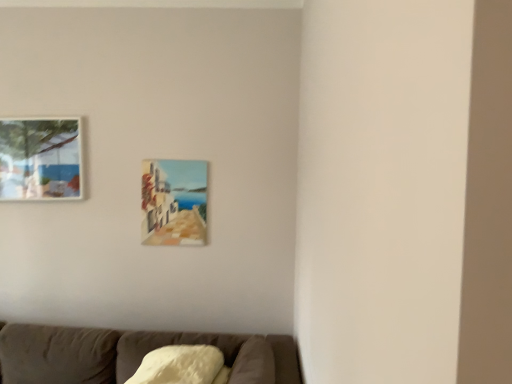
Question: Should I look upward or downward to see matte wooden picture frame at center, positioned as the second picture frame in left-to-right order?

Choices:
 (A) down
 (B) up

Answer: (A)

Question: From a real-world perspective, is matte wooden picture frame at center, the first picture frame when ordered from right to left, under matte glass picture frame at upper left, which appears as the 2th picture frame when viewed from the right?

Choices:
 (A) no
 (B) yes

Answer: (B)

Question: Is matte glass picture frame at upper left, the first picture frame positioned from the left, at the back of matte wooden picture frame at center, the first picture frame when ordered from right to left?

Choices:
 (A) no
 (B) yes

Answer: (A)

Question: From the image's perspective, is matte wooden picture frame at center, the first picture frame when ordered from right to left, located beneath matte glass picture frame at upper left, which appears as the 2th picture frame when viewed from the right?

Choices:
 (A) yes
 (B) no

Answer: (A)

Question: Does matte wooden picture frame at center, the first picture frame when ordered from right to left, have a lesser height compared to matte glass picture frame at upper left, which appears as the 2th picture frame when viewed from the right?

Choices:
 (A) yes
 (B) no

Answer: (B)

Question: Could you tell me if matte wooden picture frame at center, positioned as the second picture frame in left-to-right order, is facing matte glass picture frame at upper left, which appears as the 2th picture frame when viewed from the right?

Choices:
 (A) no
 (B) yes

Answer: (A)

Question: Can you confirm if matte wooden picture frame at center, the first picture frame when ordered from right to left, is smaller than matte glass picture frame at upper left, the first picture frame positioned from the left?

Choices:
 (A) no
 (B) yes

Answer: (B)

Question: Is matte glass picture frame at upper left, the first picture frame positioned from the left, turned away from matte wooden picture frame at center, positioned as the second picture frame in left-to-right order?

Choices:
 (A) yes
 (B) no

Answer: (B)

Question: Is matte glass picture frame at upper left, the first picture frame positioned from the left, taller than matte wooden picture frame at center, positioned as the second picture frame in left-to-right order?

Choices:
 (A) yes
 (B) no

Answer: (B)

Question: From a real-world perspective, is matte glass picture frame at upper left, which appears as the 2th picture frame when viewed from the right, over matte wooden picture frame at center, the first picture frame when ordered from right to left?

Choices:
 (A) no
 (B) yes

Answer: (B)

Question: Is matte glass picture frame at upper left, which appears as the 2th picture frame when viewed from the right, thinner than matte wooden picture frame at center, positioned as the second picture frame in left-to-right order?

Choices:
 (A) yes
 (B) no

Answer: (B)

Question: From a real-world perspective, does matte glass picture frame at upper left, which appears as the 2th picture frame when viewed from the right, sit lower than matte wooden picture frame at center, the first picture frame when ordered from right to left?

Choices:
 (A) yes
 (B) no

Answer: (B)

Question: Is matte glass picture frame at upper left, which appears as the 2th picture frame when viewed from the right, not inside matte wooden picture frame at center, the first picture frame when ordered from right to left?

Choices:
 (A) no
 (B) yes

Answer: (B)

Question: Is matte glass picture frame at upper left, the first picture frame positioned from the left, bigger or smaller than matte wooden picture frame at center, the first picture frame when ordered from right to left?

Choices:
 (A) big
 (B) small

Answer: (A)